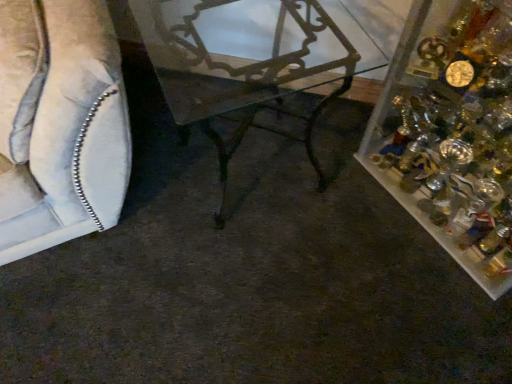
Question: Is metallic wrought iron table at center to the left of suede-like beige sofa at left from the viewer's perspective?

Choices:
 (A) no
 (B) yes

Answer: (A)

Question: Is metallic wrought iron table at center taller than suede-like beige sofa at left?

Choices:
 (A) no
 (B) yes

Answer: (A)

Question: From the image's perspective, is metallic wrought iron table at center over suede-like beige sofa at left?

Choices:
 (A) no
 (B) yes

Answer: (A)

Question: Could suede-like beige sofa at left be considered to be inside metallic wrought iron table at center?

Choices:
 (A) no
 (B) yes

Answer: (A)

Question: Is metallic wrought iron table at center next to suede-like beige sofa at left?

Choices:
 (A) no
 (B) yes

Answer: (A)

Question: In terms of width, does clear plastic container at right look wider or thinner when compared to suede-like beige sofa at left?

Choices:
 (A) thin
 (B) wide

Answer: (A)

Question: From a real-world perspective, is clear plastic container at right physically located above or below suede-like beige sofa at left?

Choices:
 (A) below
 (B) above

Answer: (A)

Question: Is point (401, 119) closer or farther from the camera than point (119, 96)?

Choices:
 (A) farther
 (B) closer

Answer: (A)

Question: Is clear plastic container at right in front of or behind suede-like beige sofa at left in the image?

Choices:
 (A) front
 (B) behind

Answer: (B)

Question: Considering the relative positions of suede-like beige sofa at left and metallic wrought iron table at center in the image provided, is suede-like beige sofa at left to the left or to the right of metallic wrought iron table at center?

Choices:
 (A) left
 (B) right

Answer: (A)

Question: Would you say suede-like beige sofa at left is inside or outside metallic wrought iron table at center?

Choices:
 (A) outside
 (B) inside

Answer: (A)

Question: From the image's perspective, is suede-like beige sofa at left located above or below metallic wrought iron table at center?

Choices:
 (A) above
 (B) below

Answer: (A)

Question: Considering the positions of suede-like beige sofa at left and metallic wrought iron table at center in the image, is suede-like beige sofa at left wider or thinner than metallic wrought iron table at center?

Choices:
 (A) thin
 (B) wide

Answer: (B)

Question: Considering the positions of point (108, 160) and point (455, 182), is point (108, 160) closer or farther from the camera than point (455, 182)?

Choices:
 (A) closer
 (B) farther

Answer: (A)

Question: Relative to clear plastic container at right, is suede-like beige sofa at left in front or behind?

Choices:
 (A) front
 (B) behind

Answer: (A)